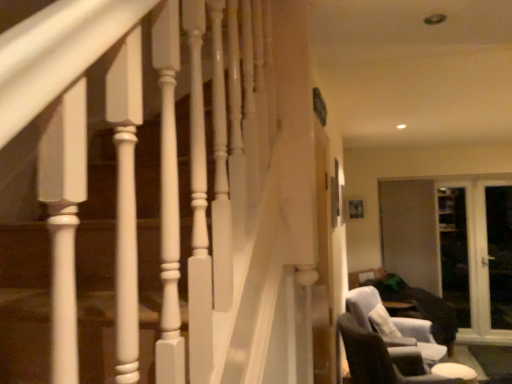
Measure the distance between point (x=385, y=182) and camera.

The distance of point (x=385, y=182) from camera is 19.28 feet.

What is the approximate width of dark gray fabric chair at lower right?

dark gray fabric chair at lower right is 35.10 inches wide.

At what (x,y) coordinates should I click in order to perform the action: click on transparent glass screen door at right, placed as the fourth screen door when sorted from right to left. Please return your answer as a coordinate pair (x, y). This screenshot has width=512, height=384. Looking at the image, I should click on (410, 232).

From a real-world perspective, is transparent glass screen door at right, which appears as the third screen door when viewed from the right, above or below white glossy door at right, placed as the first screen door when sorted from right to left?

transparent glass screen door at right, which appears as the third screen door when viewed from the right, is situated lower than white glossy door at right, placed as the first screen door when sorted from right to left, in the real world.

Measure the distance from transparent glass screen door at right, acting as the 2th screen door starting from the left, to white glossy door at right, positioned as the 4th screen door in left-to-right order.

transparent glass screen door at right, acting as the 2th screen door starting from the left, and white glossy door at right, positioned as the 4th screen door in left-to-right order, are 12.95 inches apart from each other.

Is transparent glass screen door at right, acting as the 2th screen door starting from the left, oriented away from white glossy door at right, placed as the first screen door when sorted from right to left?

Yes.

Is transparent glass screen door at right, which appears as the third screen door when viewed from the right, bigger than white glossy door at right, positioned as the 4th screen door in left-to-right order?

Correct, transparent glass screen door at right, which appears as the third screen door when viewed from the right, is larger in size than white glossy door at right, positioned as the 4th screen door in left-to-right order.

Does transparent glass screen door at right, the first screen door when ordered from left to right, turn towards transparent glass screen door at right, the 3th screen door viewed from the left?

No, transparent glass screen door at right, the first screen door when ordered from left to right, is not oriented towards transparent glass screen door at right, the 3th screen door viewed from the left.

Is transparent glass screen door at right, the first screen door when ordered from left to right, bigger or smaller than transparent glass screen door at right, the 3th screen door viewed from the left?

Considering their sizes, transparent glass screen door at right, the first screen door when ordered from left to right, takes up more space than transparent glass screen door at right, the 3th screen door viewed from the left.

Which object is further away from the camera taking this photo, transparent glass screen door at right, placed as the fourth screen door when sorted from right to left, or transparent glass screen door at right, the 3th screen door viewed from the left?

transparent glass screen door at right, the 3th screen door viewed from the left.

Can you confirm if transparent glass screen door at right, the first screen door when ordered from left to right, is positioned to the right of transparent glass screen door at right, the 3th screen door viewed from the left?

No, transparent glass screen door at right, the first screen door when ordered from left to right, is not to the right of transparent glass screen door at right, the 3th screen door viewed from the left.

What are the coordinates of `the 1st screen door to the right of the dark gray fabric swivel chair at lower right, counting from the anchor's position` in the screenshot? It's located at (410, 232).

In terms of width, does transparent glass screen door at right, placed as the fourth screen door when sorted from right to left, look wider or thinner when compared to dark gray fabric swivel chair at lower right?

In the image, transparent glass screen door at right, placed as the fourth screen door when sorted from right to left, appears to be more narrow than dark gray fabric swivel chair at lower right.

Would you consider transparent glass screen door at right, placed as the fourth screen door when sorted from right to left, to be distant from dark gray fabric swivel chair at lower right?

That's right, there is a large distance between transparent glass screen door at right, placed as the fourth screen door when sorted from right to left, and dark gray fabric swivel chair at lower right.

Considering the relative sizes of transparent glass screen door at right, placed as the fourth screen door when sorted from right to left, and dark gray fabric swivel chair at lower right in the image provided, is transparent glass screen door at right, placed as the fourth screen door when sorted from right to left, bigger than dark gray fabric swivel chair at lower right?

No, transparent glass screen door at right, placed as the fourth screen door when sorted from right to left, is not bigger than dark gray fabric swivel chair at lower right.

From the image's perspective, which is above, transparent glass screen door at right, which appears as the third screen door when viewed from the right, or dark gray fabric chair at lower right?

transparent glass screen door at right, which appears as the third screen door when viewed from the right.

What's the angular difference between transparent glass screen door at right, acting as the 2th screen door starting from the left, and dark gray fabric chair at lower right's facing directions?

There is a 111-degree angle between the facing directions of transparent glass screen door at right, acting as the 2th screen door starting from the left, and dark gray fabric chair at lower right.

Locate an element on the screen. screen door that is the 1st object above the dark gray fabric chair at lower right (from a real-world perspective) is located at coordinates (453, 245).

Can you confirm if transparent glass screen door at right, which appears as the third screen door when viewed from the right, is positioned to the left of dark gray fabric chair at lower right?

In fact, transparent glass screen door at right, which appears as the third screen door when viewed from the right, is to the right of dark gray fabric chair at lower right.

Is dark gray fabric swivel chair at lower right next to white glossy door at right, placed as the first screen door when sorted from right to left?

No, dark gray fabric swivel chair at lower right is not with white glossy door at right, placed as the first screen door when sorted from right to left.

Does dark gray fabric swivel chair at lower right have a greater width compared to white glossy door at right, positioned as the 4th screen door in left-to-right order?

Indeed, dark gray fabric swivel chair at lower right has a greater width compared to white glossy door at right, positioned as the 4th screen door in left-to-right order.

Could you measure the distance between dark gray fabric swivel chair at lower right and white glossy door at right, positioned as the 4th screen door in left-to-right order?

7.18 feet.

Could you tell me if dark gray fabric swivel chair at lower right is turned towards white glossy door at right, placed as the first screen door when sorted from right to left?

No, dark gray fabric swivel chair at lower right is not turned towards white glossy door at right, placed as the first screen door when sorted from right to left.

From a real-world perspective, does dark gray fabric chair at lower right sit lower than transparent glass screen door at right, placed as the fourth screen door when sorted from right to left?

Yes, from a real-world perspective, dark gray fabric chair at lower right is beneath transparent glass screen door at right, placed as the fourth screen door when sorted from right to left.

Looking at this image, is dark gray fabric chair at lower right far away from transparent glass screen door at right, the first screen door when ordered from left to right?

Yes, dark gray fabric chair at lower right is far from transparent glass screen door at right, the first screen door when ordered from left to right.

From the image's perspective, is dark gray fabric chair at lower right located above or below transparent glass screen door at right, the first screen door when ordered from left to right?

dark gray fabric chair at lower right is situated lower than transparent glass screen door at right, the first screen door when ordered from left to right, in the image.

Looking at the image, does dark gray fabric chair at lower right seem bigger or smaller compared to transparent glass screen door at right, the first screen door when ordered from left to right?

Clearly, dark gray fabric chair at lower right is larger in size than transparent glass screen door at right, the first screen door when ordered from left to right.

How different are the orientations of transparent glass screen door at right, the 3th screen door viewed from the left, and transparent glass screen door at right, the first screen door when ordered from left to right, in degrees?

0.00566 degrees separate the facing orientations of transparent glass screen door at right, the 3th screen door viewed from the left, and transparent glass screen door at right, the first screen door when ordered from left to right.

From the image's perspective, who appears lower, transparent glass screen door at right, the 3th screen door viewed from the left, or transparent glass screen door at right, the first screen door when ordered from left to right?

transparent glass screen door at right, the 3th screen door viewed from the left, from the image's perspective.

Considering the relative positions of transparent glass screen door at right, the 2th screen door in the right-to-left sequence, and transparent glass screen door at right, placed as the fourth screen door when sorted from right to left, in the image provided, is transparent glass screen door at right, the 2th screen door in the right-to-left sequence, behind transparent glass screen door at right, placed as the fourth screen door when sorted from right to left,?

Yes.

Considering the points (447, 206) and (418, 241), which point is behind, point (447, 206) or point (418, 241)?

The point (418, 241) is behind.

The height and width of the screenshot is (384, 512). Find the location of `the 1st screen door behind the white glossy door at right, placed as the first screen door when sorted from right to left, starting your count from the anchor`. the 1st screen door behind the white glossy door at right, placed as the first screen door when sorted from right to left, starting your count from the anchor is located at coordinates (453, 245).

Where is `the 1st screen door directly beneath the transparent glass screen door at right, placed as the fourth screen door when sorted from right to left (from a real-world perspective)`? This screenshot has height=384, width=512. the 1st screen door directly beneath the transparent glass screen door at right, placed as the fourth screen door when sorted from right to left (from a real-world perspective) is located at coordinates (454, 251).

Which object lies further to the anchor point transparent glass screen door at right, the first screen door when ordered from left to right, dark gray fabric chair at lower right or dark gray fabric swivel chair at lower right?

Based on the image, dark gray fabric chair at lower right appears to be further to transparent glass screen door at right, the first screen door when ordered from left to right.

Looking at the image, which one is located further to transparent glass screen door at right, placed as the fourth screen door when sorted from right to left, dark gray fabric chair at lower right or transparent glass screen door at right, which appears as the third screen door when viewed from the right?

Among the two, dark gray fabric chair at lower right is located further to transparent glass screen door at right, placed as the fourth screen door when sorted from right to left.

Estimate the real-world distances between objects in this image. Which object is closer to transparent glass screen door at right, the 2th screen door in the right-to-left sequence, white glossy door at right, placed as the first screen door when sorted from right to left, or dark gray fabric swivel chair at lower right?

white glossy door at right, placed as the first screen door when sorted from right to left, is positioned closer to the anchor transparent glass screen door at right, the 2th screen door in the right-to-left sequence.

Based on their spatial positions, is transparent glass screen door at right, the 3th screen door viewed from the left, or dark gray fabric swivel chair at lower right further from transparent glass screen door at right, acting as the 2th screen door starting from the left?

dark gray fabric swivel chair at lower right is further to transparent glass screen door at right, acting as the 2th screen door starting from the left.

Estimate the real-world distances between objects in this image. Which object is further from transparent glass screen door at right, placed as the fourth screen door when sorted from right to left, dark gray fabric swivel chair at lower right or dark gray fabric chair at lower right?

Based on the image, dark gray fabric chair at lower right appears to be further to transparent glass screen door at right, placed as the fourth screen door when sorted from right to left.

Based on their spatial positions, is transparent glass screen door at right, placed as the fourth screen door when sorted from right to left, or dark gray fabric swivel chair at lower right further from transparent glass screen door at right, acting as the 2th screen door starting from the left?

The object further to transparent glass screen door at right, acting as the 2th screen door starting from the left, is dark gray fabric swivel chair at lower right.

From the image, which object appears to be farther from transparent glass screen door at right, the first screen door when ordered from left to right, white glossy door at right, placed as the first screen door when sorted from right to left, or transparent glass screen door at right, the 2th screen door in the right-to-left sequence?

Based on the image, white glossy door at right, placed as the first screen door when sorted from right to left, appears to be further to transparent glass screen door at right, the first screen door when ordered from left to right.

Considering their positions, is white glossy door at right, placed as the first screen door when sorted from right to left, positioned closer to transparent glass screen door at right, the 2th screen door in the right-to-left sequence, than dark gray fabric chair at lower right?

white glossy door at right, placed as the first screen door when sorted from right to left, is closer to transparent glass screen door at right, the 2th screen door in the right-to-left sequence.

This screenshot has width=512, height=384. Find the location of `swivel chair positioned between dark gray fabric chair at lower right and transparent glass screen door at right, acting as the 2th screen door starting from the left, from near to far`. swivel chair positioned between dark gray fabric chair at lower right and transparent glass screen door at right, acting as the 2th screen door starting from the left, from near to far is located at coordinates (x=393, y=324).

Locate an element on the screen. Image resolution: width=512 pixels, height=384 pixels. screen door between dark gray fabric chair at lower right and transparent glass screen door at right, which appears as the third screen door when viewed from the right, from front to back is located at coordinates (498, 254).

You are a GUI agent. You are given a task and a screenshot of the screen. Output one action in this format:
    pyautogui.click(x=<x>, y=<y>)
    Task: Click on the screen door positioned between dark gray fabric swivel chair at lower right and transparent glass screen door at right, which appears as the third screen door when viewed from the right, from near to far
    The image size is (512, 384).
    Given the screenshot: What is the action you would take?
    pyautogui.click(x=498, y=254)

You are a GUI agent. You are given a task and a screenshot of the screen. Output one action in this format:
    pyautogui.click(x=<x>, y=<y>)
    Task: Click on the screen door situated between transparent glass screen door at right, which appears as the third screen door when viewed from the right, and white glossy door at right, positioned as the 4th screen door in left-to-right order, from left to right
    This screenshot has width=512, height=384.
    Given the screenshot: What is the action you would take?
    [454, 251]